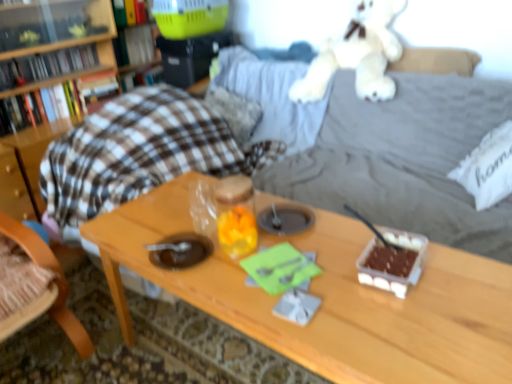
Question: Is hardcover book at upper left, which ranks as the first book in top-to-bottom order, wider or thinner than white fabric pillow at right?

Choices:
 (A) thin
 (B) wide

Answer: (A)

Question: From the image's perspective, relative to white fabric pillow at right, is hardcover book at upper left, which ranks as the first book in top-to-bottom order, above or below?

Choices:
 (A) above
 (B) below

Answer: (A)

Question: Estimate the real-world distances between objects in this image. Which object is closer to the green plastic book at upper center, the second book positioned from the top?

Choices:
 (A) wooden table at center
 (B) hardcover book at upper left, the 3th book positioned from the top
 (C) wooden chair at left
 (D) hardcover book at left, the fourth book positioned from the top
 (E) hardcover book at upper left, which ranks as the first book in top-to-bottom order

Answer: (E)

Question: Estimate the real-world distances between objects in this image. Which object is farther from the wooden table at center?

Choices:
 (A) white fabric pillow at right
 (B) white plush at upper center
 (C) hardcover book at left, the fourth book positioned from the top
 (D) wooden chair at left
 (E) hardcover book at upper left, the 3th book positioned from the top

Answer: (E)